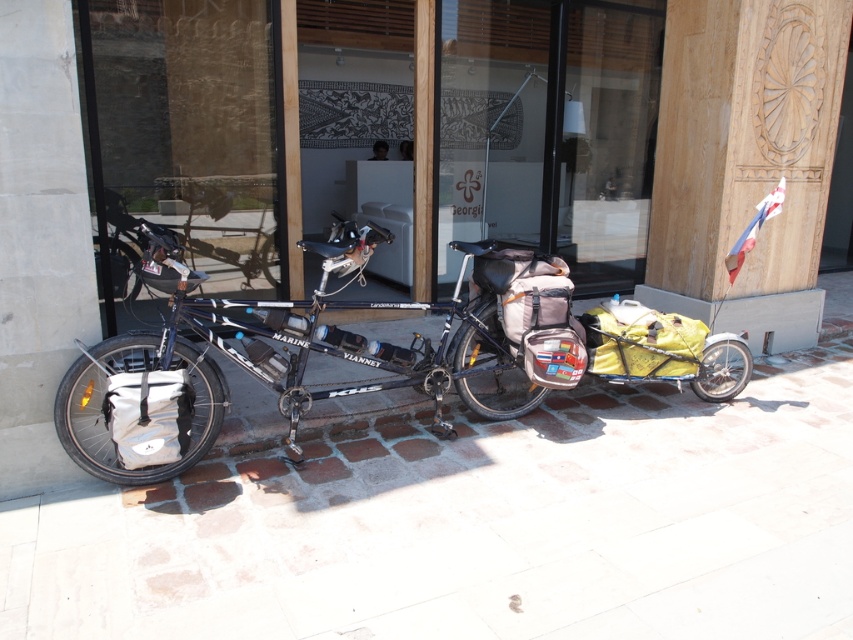
Question: Does matte black bicycle at center appear on the left side of concrete at left?

Choices:
 (A) yes
 (B) no

Answer: (B)

Question: Which is farther from the white fabric bag at lower left?

Choices:
 (A) white stone pavement at lower center
 (B) concrete at left

Answer: (A)

Question: Is white stone pavement at lower center in front of matte black bicycle at center?

Choices:
 (A) yes
 (B) no

Answer: (A)

Question: Does concrete at left have a greater width compared to white fabric bag at lower left?

Choices:
 (A) no
 (B) yes

Answer: (B)

Question: Which of these objects is positioned farthest from the concrete at left?

Choices:
 (A) matte black bicycle at center
 (B) white fabric bag at lower left
 (C) white stone pavement at lower center

Answer: (C)

Question: Which object is farther from the camera taking this photo?

Choices:
 (A) concrete at left
 (B) white fabric bag at lower left
 (C) white stone pavement at lower center
 (D) matte black bicycle at center

Answer: (D)